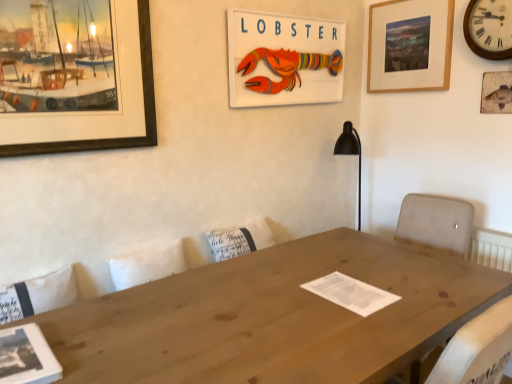
You are a GUI agent. You are given a task and a screenshot of the screen. Output one action in this format:
    pyautogui.click(x=<x>, y=<y>)
    Task: Click on the wooden picture frame at upper right, which is counted as the first picture frame, starting from the right
    
    Given the screenshot: What is the action you would take?
    pyautogui.click(x=496, y=92)

You are a GUI agent. You are given a task and a screenshot of the screen. Output one action in this format:
    pyautogui.click(x=<x>, y=<y>)
    Task: Click on the wooden picture frame at upper left, which is the first picture frame in left-to-right order
    The height and width of the screenshot is (384, 512).
    Given the screenshot: What is the action you would take?
    pyautogui.click(x=109, y=138)

Measure the distance between wooden picture frame at upper left, which is the first picture frame in left-to-right order, and camera.

wooden picture frame at upper left, which is the first picture frame in left-to-right order, and camera are 5.15 feet apart from each other.

What is the approximate width of wooden lobster sign at upper center, acting as the 2th picture frame starting from the left?

wooden lobster sign at upper center, acting as the 2th picture frame starting from the left, is 2.65 inches in width.

What are the coordinates of `wooden picture frame at upper right, marked as the third picture frame in a left-to-right arrangement` in the screenshot? It's located at (410, 46).

From the image's perspective, which is above, wooden picture frame at upper right, marked as the third picture frame in a left-to-right arrangement, or wooden picture frame at upper left, the 4th picture frame in the right-to-left sequence?

wooden picture frame at upper right, marked as the third picture frame in a left-to-right arrangement, appears higher in the image.

Considering the relative sizes of wooden picture frame at upper right, marked as the third picture frame in a left-to-right arrangement, and wooden picture frame at upper left, the 4th picture frame in the right-to-left sequence, in the image provided, is wooden picture frame at upper right, marked as the third picture frame in a left-to-right arrangement, shorter than wooden picture frame at upper left, the 4th picture frame in the right-to-left sequence,?

Correct, wooden picture frame at upper right, marked as the third picture frame in a left-to-right arrangement, is not as tall as wooden picture frame at upper left, the 4th picture frame in the right-to-left sequence.

Can wooden picture frame at upper left, the 4th picture frame in the right-to-left sequence, be found inside wooden picture frame at upper right, marked as the third picture frame in a left-to-right arrangement?

No.

Are wooden picture frame at upper right, placed as the second picture frame when sorted from right to left, and wooden picture frame at upper left, which is the first picture frame in left-to-right order, located far from each other?

wooden picture frame at upper right, placed as the second picture frame when sorted from right to left, is far away from wooden picture frame at upper left, which is the first picture frame in left-to-right order.

Could you measure the distance between natural wood table at center and wooden picture frame at upper left, the 4th picture frame in the right-to-left sequence?

natural wood table at center is 37.91 inches away from wooden picture frame at upper left, the 4th picture frame in the right-to-left sequence.

From the image's perspective, is natural wood table at center below wooden picture frame at upper left, the 4th picture frame in the right-to-left sequence?

Yes, from the image's perspective, natural wood table at center is beneath wooden picture frame at upper left, the 4th picture frame in the right-to-left sequence.

Is natural wood table at center not close to wooden picture frame at upper left, which is the first picture frame in left-to-right order?

No, natural wood table at center is not far away from wooden picture frame at upper left, which is the first picture frame in left-to-right order.

Which is less distant, (106, 352) or (33, 146)?

Point (106, 352) is closer to the camera than point (33, 146).

Can you confirm if wooden clock at upper right is shorter than wooden picture frame at upper right, which is counted as the first picture frame, starting from the right?

No, wooden clock at upper right is not shorter than wooden picture frame at upper right, which is counted as the first picture frame, starting from the right.

Relative to wooden picture frame at upper right, which is counted as the first picture frame, starting from the right, is wooden clock at upper right in front or behind?

In the image, wooden clock at upper right appears in front of wooden picture frame at upper right, which is counted as the first picture frame, starting from the right.

Which of these two, wooden clock at upper right or wooden picture frame at upper right, which is counted as the first picture frame, starting from the right, is smaller?

Smaller between the two is wooden picture frame at upper right, which is counted as the first picture frame, starting from the right.

Can you confirm if wooden picture frame at upper right, the fourth picture frame in the left-to-right sequence, is positioned to the right of natural wood table at center?

Yes.

Between wooden picture frame at upper right, the fourth picture frame in the left-to-right sequence, and natural wood table at center, which one is positioned behind?

wooden picture frame at upper right, the fourth picture frame in the left-to-right sequence, is further from the camera.

Is wooden picture frame at upper right, which is counted as the first picture frame, starting from the right, turned away from natural wood table at center?

That's not correct — wooden picture frame at upper right, which is counted as the first picture frame, starting from the right, is not looking away from natural wood table at center.

Considering the relative sizes of wooden picture frame at upper right, the fourth picture frame in the left-to-right sequence, and natural wood table at center in the image provided, is wooden picture frame at upper right, the fourth picture frame in the left-to-right sequence, shorter than natural wood table at center?

Correct, wooden picture frame at upper right, the fourth picture frame in the left-to-right sequence, is not as tall as natural wood table at center.

Consider the image. Considering the relative sizes of wooden picture frame at upper right, the fourth picture frame in the left-to-right sequence, and wooden picture frame at upper left, the 4th picture frame in the right-to-left sequence, in the image provided, is wooden picture frame at upper right, the fourth picture frame in the left-to-right sequence, bigger than wooden picture frame at upper left, the 4th picture frame in the right-to-left sequence,?

No.

Is the depth of wooden picture frame at upper right, which is counted as the first picture frame, starting from the right, less than that of wooden picture frame at upper left, the 4th picture frame in the right-to-left sequence?

No, wooden picture frame at upper right, which is counted as the first picture frame, starting from the right, is further to the viewer.

Is wooden picture frame at upper right, which is counted as the first picture frame, starting from the right, turned away from wooden picture frame at upper left, the 4th picture frame in the right-to-left sequence?

No.

What's the angular difference between wooden picture frame at upper right, which is counted as the first picture frame, starting from the right, and wooden picture frame at upper left, which is the first picture frame in left-to-right order,'s facing directions?

88.5 degrees.

Considering the positions of point (510, 100) and point (506, 1), is point (510, 100) closer or farther from the camera than point (506, 1)?

Point (510, 100) appears to be farther away from the viewer than point (506, 1).

Is wooden picture frame at upper right, the fourth picture frame in the left-to-right sequence, positioned with its back to wooden clock at upper right?

No.

Relative to wooden clock at upper right, is wooden picture frame at upper right, the fourth picture frame in the left-to-right sequence, in front or behind?

Clearly, wooden picture frame at upper right, the fourth picture frame in the left-to-right sequence, is behind wooden clock at upper right.

Which is more to the left, wooden clock at upper right or wooden picture frame at upper left, the 4th picture frame in the right-to-left sequence?

wooden picture frame at upper left, the 4th picture frame in the right-to-left sequence.

Considering the sizes of objects wooden clock at upper right and wooden picture frame at upper left, the 4th picture frame in the right-to-left sequence, in the image provided, who is taller, wooden clock at upper right or wooden picture frame at upper left, the 4th picture frame in the right-to-left sequence,?

Standing taller between the two is wooden picture frame at upper left, the 4th picture frame in the right-to-left sequence.

Considering the positions of point (489, 25) and point (145, 55), is point (489, 25) closer or farther from the camera than point (145, 55)?

Point (489, 25) is farther from the camera than point (145, 55).

In terms of size, does wooden clock at upper right appear bigger or smaller than wooden picture frame at upper left, which is the first picture frame in left-to-right order?

wooden clock at upper right is smaller than wooden picture frame at upper left, which is the first picture frame in left-to-right order.

From the image's perspective, which picture frame is the 3rd one above the wooden picture frame at upper left, which is the first picture frame in left-to-right order? Please provide its 2D coordinates.

[(410, 46)]

Where is `the 2nd picture frame directly above the natural wood table at center (from a real-world perspective)`? the 2nd picture frame directly above the natural wood table at center (from a real-world perspective) is located at coordinates (109, 138).

Based on their spatial positions, is wooden lobster sign at upper center, acting as the 2th picture frame starting from the left, or wooden picture frame at upper left, the 4th picture frame in the right-to-left sequence, further from wooden picture frame at upper right, placed as the second picture frame when sorted from right to left?

wooden picture frame at upper left, the 4th picture frame in the right-to-left sequence, is further to wooden picture frame at upper right, placed as the second picture frame when sorted from right to left.

Based on their spatial positions, is wooden lobster sign at upper center, acting as the 3th picture frame starting from the right, or natural wood table at center further from wooden picture frame at upper right, placed as the second picture frame when sorted from right to left?

The object further to wooden picture frame at upper right, placed as the second picture frame when sorted from right to left, is natural wood table at center.

Considering their positions, is natural wood table at center positioned closer to wooden picture frame at upper right, marked as the third picture frame in a left-to-right arrangement, than wooden clock at upper right?

Among the two, wooden clock at upper right is located nearer to wooden picture frame at upper right, marked as the third picture frame in a left-to-right arrangement.

From the picture: From the image, which object appears to be farther from wooden picture frame at upper right, which is counted as the first picture frame, starting from the right, natural wood table at center or wooden picture frame at upper right, placed as the second picture frame when sorted from right to left?

Among the two, natural wood table at center is located further to wooden picture frame at upper right, which is counted as the first picture frame, starting from the right.

Considering their positions, is natural wood table at center positioned further to wooden picture frame at upper right, the fourth picture frame in the left-to-right sequence, than wooden clock at upper right?

natural wood table at center.

Looking at this image, when comparing their distances from wooden picture frame at upper left, which is the first picture frame in left-to-right order, does wooden picture frame at upper right, which is counted as the first picture frame, starting from the right, or wooden clock at upper right seem closer?

wooden clock at upper right is positioned closer to the anchor wooden picture frame at upper left, which is the first picture frame in left-to-right order.

From the image, which object appears to be nearer to wooden picture frame at upper left, the 4th picture frame in the right-to-left sequence, wooden clock at upper right or wooden picture frame at upper right, placed as the second picture frame when sorted from right to left?

Based on the image, wooden picture frame at upper right, placed as the second picture frame when sorted from right to left, appears to be nearer to wooden picture frame at upper left, the 4th picture frame in the right-to-left sequence.

Considering their positions, is wooden picture frame at upper right, placed as the second picture frame when sorted from right to left, positioned closer to wooden picture frame at upper left, the 4th picture frame in the right-to-left sequence, than wooden clock at upper right?

wooden picture frame at upper right, placed as the second picture frame when sorted from right to left, is positioned closer to the anchor wooden picture frame at upper left, the 4th picture frame in the right-to-left sequence.

This screenshot has height=384, width=512. I want to click on table between wooden picture frame at upper left, which is the first picture frame in left-to-right order, and wooden picture frame at upper right, which is counted as the first picture frame, starting from the right, so click(273, 317).

Where is `clock between wooden picture frame at upper right, placed as the second picture frame when sorted from right to left, and natural wood table at center in the up-down direction`? clock between wooden picture frame at upper right, placed as the second picture frame when sorted from right to left, and natural wood table at center in the up-down direction is located at coordinates (489, 28).

The image size is (512, 384). I want to click on picture frame between wooden picture frame at upper left, which is the first picture frame in left-to-right order, and wooden picture frame at upper right, placed as the second picture frame when sorted from right to left, so click(x=283, y=59).

Where is `clock situated between wooden picture frame at upper left, the 4th picture frame in the right-to-left sequence, and wooden picture frame at upper right, the fourth picture frame in the left-to-right sequence, from left to right`? clock situated between wooden picture frame at upper left, the 4th picture frame in the right-to-left sequence, and wooden picture frame at upper right, the fourth picture frame in the left-to-right sequence, from left to right is located at coordinates (489, 28).